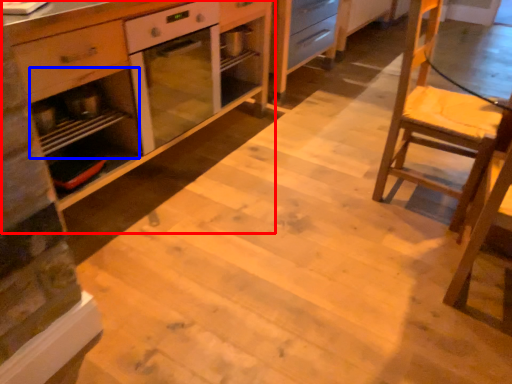
Question: Which point is further to the camera, cabinetry (highlighted by a red box) or shelf (highlighted by a blue box)?

Choices:
 (A) cabinetry
 (B) shelf

Answer: (B)